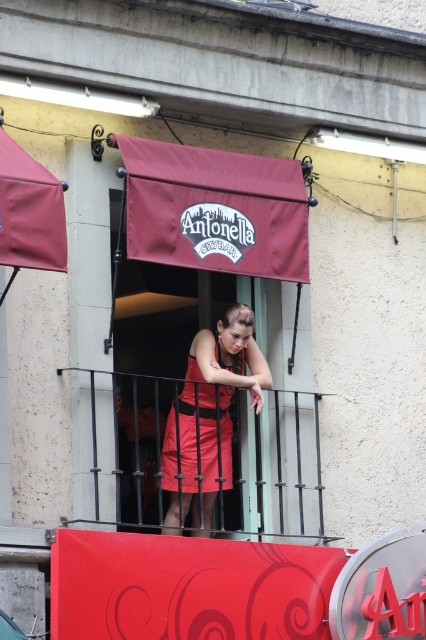
Measure the distance between black metal railing at center and matte red dress at center.

3.01 meters

Is black metal railing at center positioned in front of matte red dress at center?

Yes, it is.

I want to click on black metal railing at center, so click(x=273, y=468).

Does black metal railing at center have a lesser height compared to satin red dress at center?

In fact, black metal railing at center may be taller than satin red dress at center.

Between point (264, 502) and point (184, 428), which one is positioned behind?

Point (264, 502)

Who is more forward, (164, 509) or (164, 474)?

Positioned in front is point (164, 474).

The width and height of the screenshot is (426, 640). Find the location of `black metal railing at center`. black metal railing at center is located at coordinates (273, 468).

Between point (221, 362) and point (226, 484), which one is positioned in front?

Positioned in front is point (221, 362).

In order to click on matte red dress at center in this screenshot , I will do `click(218, 404)`.

Is point (201, 371) farther from camera compared to point (161, 464)?

Yes, point (201, 371) is behind point (161, 464).

Identify the location of matte red dress at center. (218, 404).